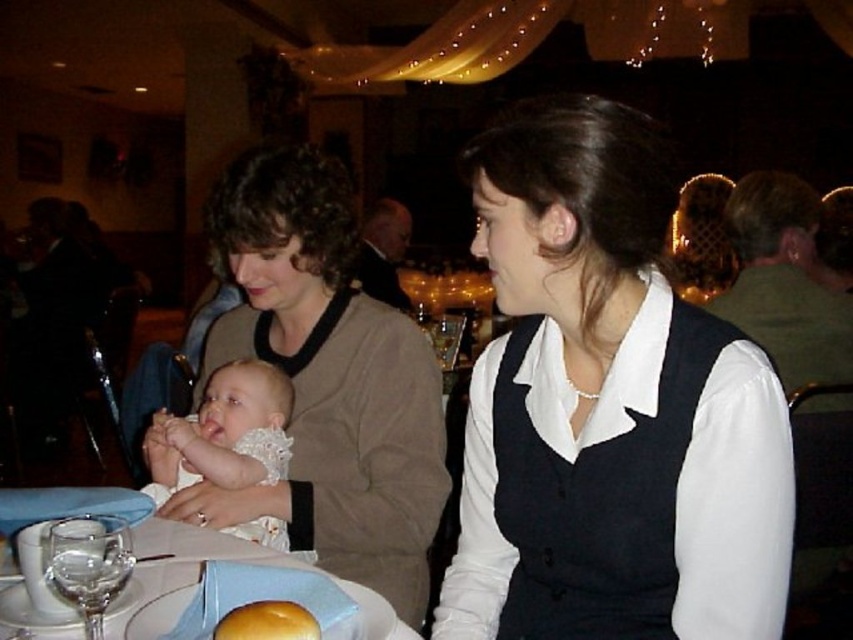
Question: Is white porcelain plate at lower left smaller than white shirt at center?

Choices:
 (A) no
 (B) yes

Answer: (B)

Question: Where is white porcelain plate at lower left located in relation to white shirt at center in the image?

Choices:
 (A) above
 (B) below

Answer: (B)

Question: Does white lace baby at center appear over clear glass wine glass at lower left?

Choices:
 (A) yes
 (B) no

Answer: (A)

Question: Which of these objects is positioned farthest from the clear glass wine glass at lower left?

Choices:
 (A) golden matte bread at lower center
 (B) white porcelain plate at lower left
 (C) white matte vest at center
 (D) matte beige sweater at center

Answer: (D)

Question: Which of the following is the farthest from the observer?

Choices:
 (A) white lace baby at center
 (B) matte beige sweater at center

Answer: (A)

Question: Which point is closer to the camera?

Choices:
 (A) click(202, 541)
 (B) click(479, 524)
 (C) click(314, 426)

Answer: (A)